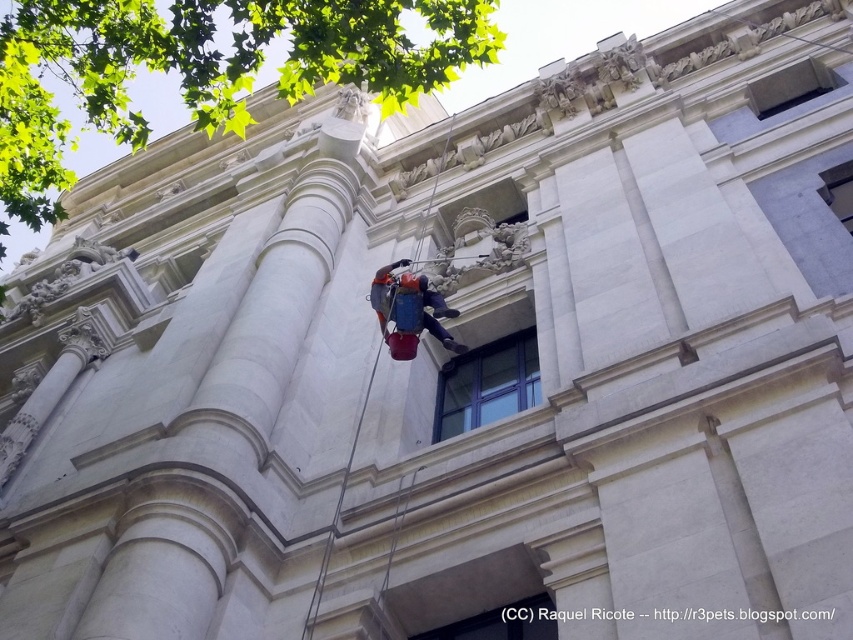
Which of these two, blue glass window at center or orange fabric harness at center, stands taller?

With more height is orange fabric harness at center.

Which is in front, point (490, 365) or point (375, 294)?

Point (375, 294) is in front.

Image resolution: width=853 pixels, height=640 pixels. I want to click on blue glass window at center, so click(486, 384).